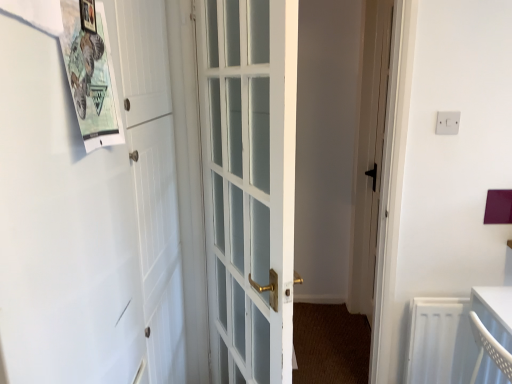
Question: Is paperboard poster at upper left located outside white plastic electric outlet at upper right?

Choices:
 (A) no
 (B) yes

Answer: (B)

Question: From the image's perspective, is paperboard poster at upper left located beneath white plastic electric outlet at upper right?

Choices:
 (A) yes
 (B) no

Answer: (A)

Question: Is paperboard poster at upper left placed right next to white plastic electric outlet at upper right?

Choices:
 (A) yes
 (B) no

Answer: (B)

Question: Does paperboard poster at upper left have a greater width compared to white plastic electric outlet at upper right?

Choices:
 (A) no
 (B) yes

Answer: (B)

Question: Is paperboard poster at upper left oriented towards white plastic electric outlet at upper right?

Choices:
 (A) no
 (B) yes

Answer: (A)

Question: From a real-world perspective, is white plastic electric outlet at upper right positioned above or below wooden picture frame at upper left?

Choices:
 (A) above
 (B) below

Answer: (B)

Question: Is white plastic electric outlet at upper right inside or outside of wooden picture frame at upper left?

Choices:
 (A) inside
 (B) outside

Answer: (B)

Question: Would you say white plastic electric outlet at upper right is to the left or to the right of wooden picture frame at upper left in the picture?

Choices:
 (A) right
 (B) left

Answer: (A)

Question: Is point (440, 119) closer or farther from the camera than point (87, 13)?

Choices:
 (A) farther
 (B) closer

Answer: (A)

Question: Is point (86, 3) positioned closer to the camera than point (443, 130)?

Choices:
 (A) closer
 (B) farther

Answer: (A)

Question: From the image's perspective, relative to white plastic electric outlet at upper right, is wooden picture frame at upper left above or below?

Choices:
 (A) below
 (B) above

Answer: (B)

Question: Considering the relative positions of wooden picture frame at upper left and white plastic electric outlet at upper right in the image provided, is wooden picture frame at upper left to the left or to the right of white plastic electric outlet at upper right?

Choices:
 (A) right
 (B) left

Answer: (B)

Question: Relative to white plastic electric outlet at upper right, is wooden picture frame at upper left in front or behind?

Choices:
 (A) behind
 (B) front

Answer: (B)

Question: From a real-world perspective, is white plastic electric outlet at upper right physically located above or below white glass door at center?

Choices:
 (A) above
 (B) below

Answer: (A)

Question: From the image's perspective, is white plastic electric outlet at upper right above or below white glass door at center?

Choices:
 (A) below
 (B) above

Answer: (B)